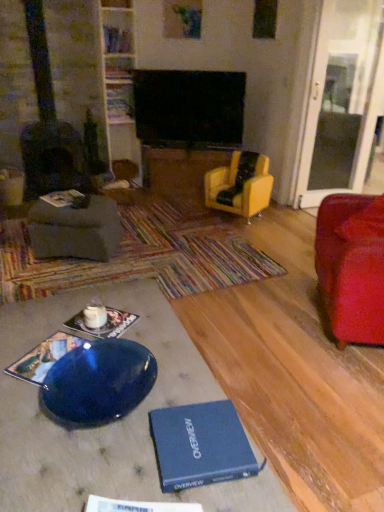
Question: In terms of width, does velvet red armchair at right, the 2th chair from the left, look wider or thinner when compared to matte gray footrest at left?

Choices:
 (A) thin
 (B) wide

Answer: (B)

Question: In the image, is velvet red armchair at right, marked as the 1th chair in a front-to-back arrangement, positioned in front of or behind matte gray footrest at left?

Choices:
 (A) front
 (B) behind

Answer: (A)

Question: Which object is the farthest from the multicolored woven mat at center?

Choices:
 (A) hardcover book at left, which appears as the 4th book when ordered from the bottom
 (B) matte gray footrest at left
 (C) transparent glass door at right
 (D) velvet red armchair at right, marked as the 1th chair in a front-to-back arrangement
 (E) yellow leather armchair at center, marked as the second chair in a front-to-back arrangement

Answer: (C)

Question: Estimate the real-world distances between objects in this image. Which object is farther from the matte gray footrest at left?

Choices:
 (A) blue hardcover book at lower center
 (B) blue hardcover book at lower left, which is counted as the second book, starting from the front
 (C) transparent glass door at right
 (D) hardcover book at upper center, the 2th book viewed from the top
 (E) velvet red armchair at right, the 2th chair from the left

Answer: (C)